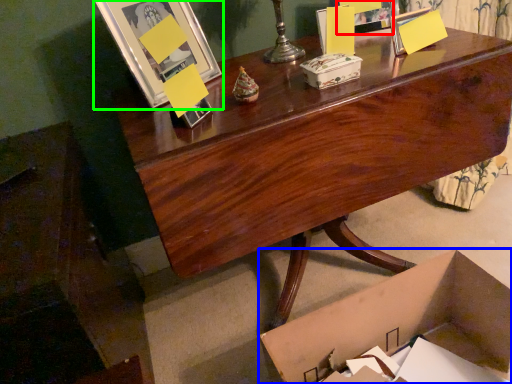
Question: Which object is the farthest from picture frame (highlighted by a red box)? Choose among these: box (highlighted by a blue box) or picture frame (highlighted by a green box).

Choices:
 (A) box
 (B) picture frame

Answer: (A)